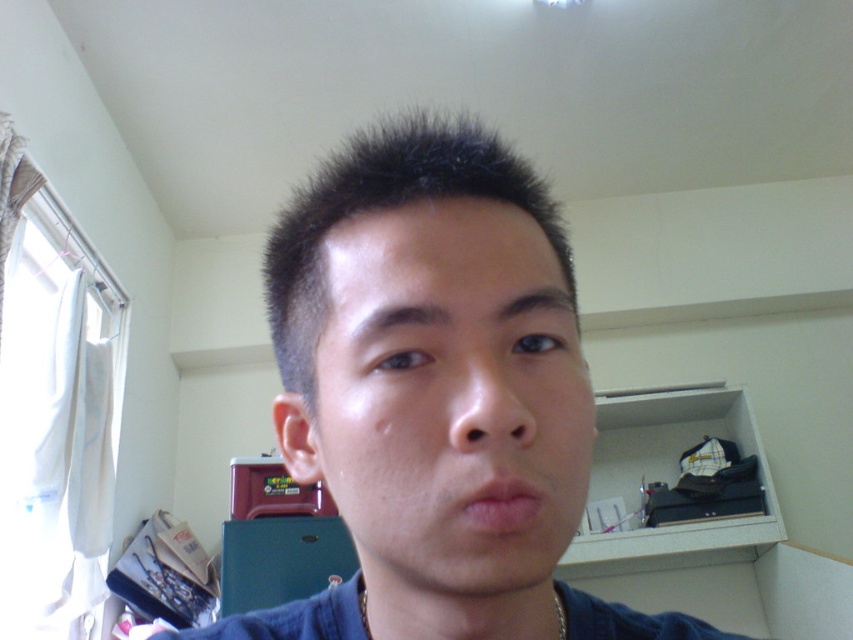
Which is below, blue denim shirt at center or gold chain at lower center?

gold chain at lower center is lower down.

Can you confirm if blue denim shirt at center is shorter than gold chain at lower center?

No.

Does point (401, 369) come closer to viewer compared to point (554, 595)?

Yes.

I want to click on blue denim shirt at center, so click(x=434, y=396).

Does point (339, 289) come behind point (427, 179)?

No, it is in front of (427, 179).

From the picture: Who is lower down, smooth skin face at center or dark brown spiky hair at center?

smooth skin face at center

Is point (408, 525) positioned behind point (265, 292)?

No, (408, 525) is closer to viewer.

I want to click on smooth skin face at center, so click(450, 397).

Can you confirm if blue denim shirt at center is smaller than smooth skin face at center?

No, blue denim shirt at center is not smaller than smooth skin face at center.

I want to click on blue denim shirt at center, so click(434, 396).